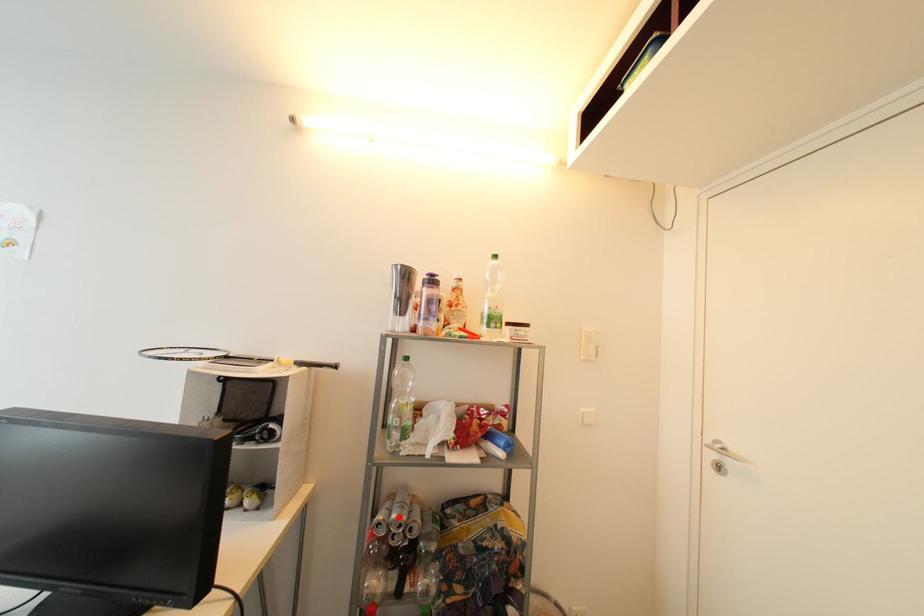
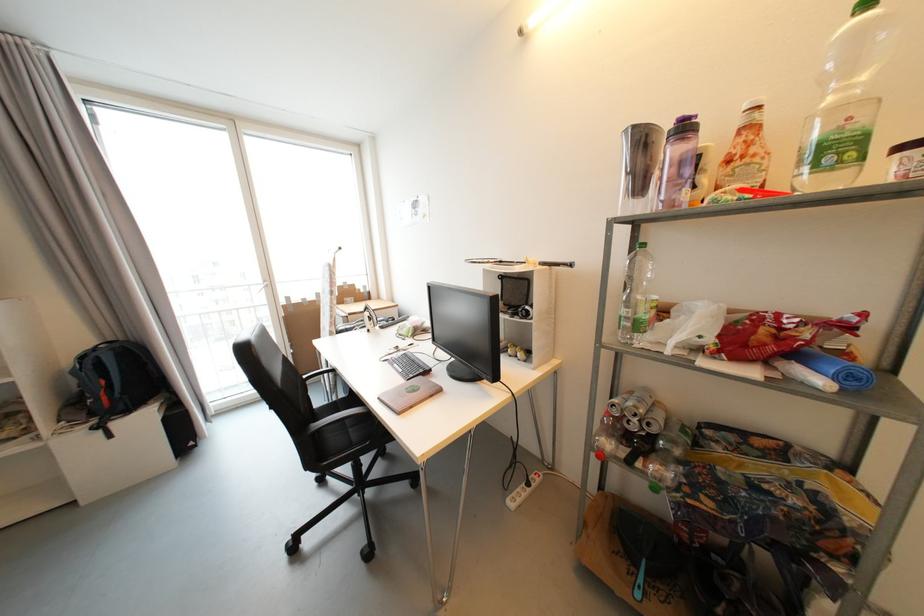
Question: I am providing you with two images of the same scene from different viewpoints. A red point is marked on the first image. Can you still see the location of the red point in image 2?

Choices:
 (A) Yes
 (B) No

Answer: (A)